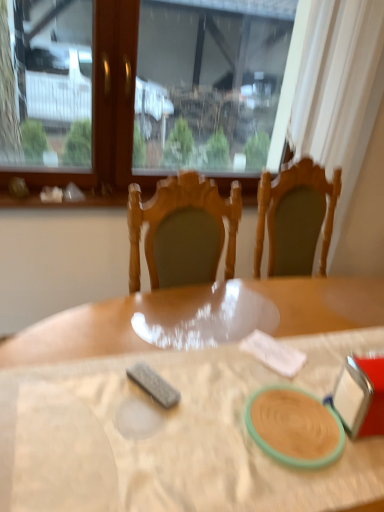
Question: Does point (43, 458) appear closer or farther from the camera than point (160, 91)?

Choices:
 (A) farther
 (B) closer

Answer: (B)

Question: Considering their positions, is wooden table at center located in front of or behind transparent glass window at upper center?

Choices:
 (A) front
 (B) behind

Answer: (A)

Question: Which is nearer to the matte green plate at center?

Choices:
 (A) wooden table at center
 (B) transparent glass window at upper center

Answer: (A)

Question: Estimate the real-world distances between objects in this image. Which object is closer to the wooden table at center?

Choices:
 (A) transparent glass window at upper center
 (B) matte green plate at center

Answer: (B)